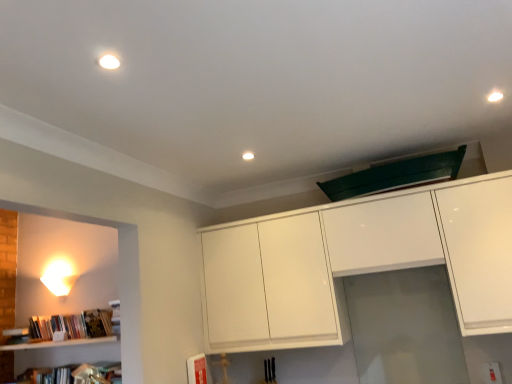
Question: Is white glossy wall sconce at left not within transparent glass door at center?

Choices:
 (A) yes
 (B) no

Answer: (A)

Question: Can you confirm if white glossy wall sconce at left is wider than transparent glass door at center?

Choices:
 (A) yes
 (B) no

Answer: (A)

Question: Could transparent glass door at center be considered to be inside white glossy wall sconce at left?

Choices:
 (A) no
 (B) yes

Answer: (A)

Question: Can you confirm if white glossy wall sconce at left is taller than transparent glass door at center?

Choices:
 (A) no
 (B) yes

Answer: (A)

Question: From a real-world perspective, is white glossy wall sconce at left positioned over transparent glass door at center based on gravity?

Choices:
 (A) yes
 (B) no

Answer: (A)

Question: From their relative heights in the image, would you say white glossy wall sconce at left is taller or shorter than white glossy cabinet at upper center?

Choices:
 (A) tall
 (B) short

Answer: (B)

Question: Looking at their shapes, would you say white glossy wall sconce at left is wider or thinner than white glossy cabinet at upper center?

Choices:
 (A) thin
 (B) wide

Answer: (A)

Question: In terms of size, does white glossy wall sconce at left appear bigger or smaller than white glossy cabinet at upper center?

Choices:
 (A) small
 (B) big

Answer: (A)

Question: From the image's perspective, is white glossy wall sconce at left positioned above or below white glossy cabinet at upper center?

Choices:
 (A) above
 (B) below

Answer: (B)

Question: Is white glossy cabinet at upper center wider or thinner than transparent glass door at center?

Choices:
 (A) wide
 (B) thin

Answer: (A)

Question: From the image's perspective, is white glossy cabinet at upper center located above or below transparent glass door at center?

Choices:
 (A) above
 (B) below

Answer: (A)

Question: Considering their positions, is white glossy cabinet at upper center located in front of or behind transparent glass door at center?

Choices:
 (A) front
 (B) behind

Answer: (A)

Question: Is white glossy cabinet at upper center bigger or smaller than transparent glass door at center?

Choices:
 (A) big
 (B) small

Answer: (A)

Question: Do you think white glossy cabinet at upper center is within white glossy wall sconce at left, or outside of it?

Choices:
 (A) outside
 (B) inside

Answer: (A)

Question: In terms of height, does white glossy cabinet at upper center look taller or shorter compared to white glossy wall sconce at left?

Choices:
 (A) tall
 (B) short

Answer: (A)